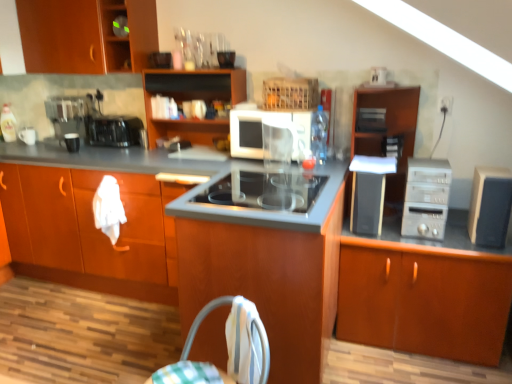
Question: Is wooden cabinet at center, the fifth cabinetry viewed from the left, positioned behind wooden cabinet at center, the second cabinetry viewed from the left?

Choices:
 (A) yes
 (B) no

Answer: (A)

Question: From the image's perspective, is wooden cabinet at center, the 3th cabinetry in the right-to-left sequence, beneath wooden cabinet at center, the second cabinetry viewed from the left?

Choices:
 (A) no
 (B) yes

Answer: (B)

Question: Can you confirm if wooden cabinet at center, the 3th cabinetry in the right-to-left sequence, is shorter than wooden cabinet at center, positioned as the 6th cabinetry in right-to-left order?

Choices:
 (A) no
 (B) yes

Answer: (B)

Question: Is wooden cabinet at center, the 3th cabinetry in the right-to-left sequence, bigger than wooden cabinet at center, the second cabinetry viewed from the left?

Choices:
 (A) yes
 (B) no

Answer: (B)

Question: Is wooden cabinet at center, the fifth cabinetry viewed from the left, to the right of wooden cabinet at center, positioned as the 6th cabinetry in right-to-left order, from the viewer's perspective?

Choices:
 (A) yes
 (B) no

Answer: (A)

Question: Looking at the image, does satin silver toaster at upper center, the third appliance from the back, seem bigger or smaller compared to satin silver computer tower at right?

Choices:
 (A) small
 (B) big

Answer: (A)

Question: Is point (378, 124) closer or farther from the camera than point (409, 168)?

Choices:
 (A) farther
 (B) closer

Answer: (A)

Question: Considering the positions of satin silver toaster at upper center, which is the fourth appliance in left-to-right order, and satin silver computer tower at right in the image, is satin silver toaster at upper center, which is the fourth appliance in left-to-right order, taller or shorter than satin silver computer tower at right?

Choices:
 (A) tall
 (B) short

Answer: (B)

Question: Based on their positions, is satin silver toaster at upper center, which is the fourth appliance in left-to-right order, located to the left or right of satin silver computer tower at right?

Choices:
 (A) left
 (B) right

Answer: (A)

Question: In the image, is black matte mug at left, which is the 4th appliance in front-to-back order, on the left side or the right side of brown wood cabinet at right, placed as the seventh cabinetry when sorted from left to right?

Choices:
 (A) right
 (B) left

Answer: (B)

Question: In terms of width, does black matte mug at left, the 4th appliance from the right, look wider or thinner when compared to brown wood cabinet at right, which ranks as the 1th cabinetry in right-to-left order?

Choices:
 (A) wide
 (B) thin

Answer: (B)

Question: Relative to brown wood cabinet at right, which ranks as the 1th cabinetry in right-to-left order, is black matte mug at left, the 4th appliance from the right, in front or behind?

Choices:
 (A) front
 (B) behind

Answer: (B)

Question: Does point 76,147 appear closer or farther from the camera than point 408,337?

Choices:
 (A) closer
 (B) farther

Answer: (B)

Question: Looking at their shapes, would you say clear plastic bottle at center is wider or thinner than satin silver computer tower at right?

Choices:
 (A) wide
 (B) thin

Answer: (B)

Question: Is clear plastic bottle at center bigger or smaller than satin silver computer tower at right?

Choices:
 (A) big
 (B) small

Answer: (B)